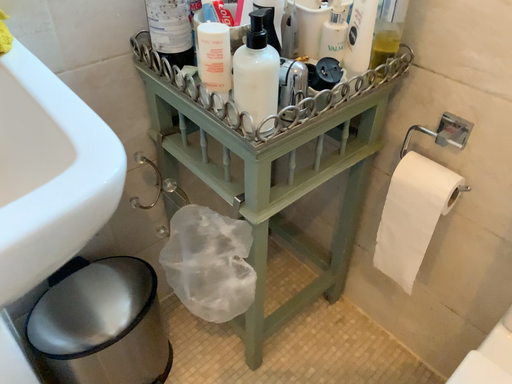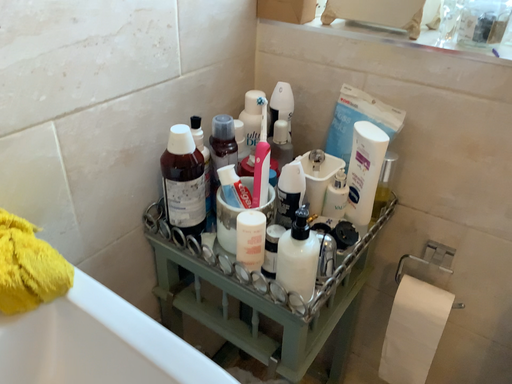
Question: How did the camera likely rotate when shooting the video?

Choices:
 (A) rotated downward
 (B) rotated upward

Answer: (B)